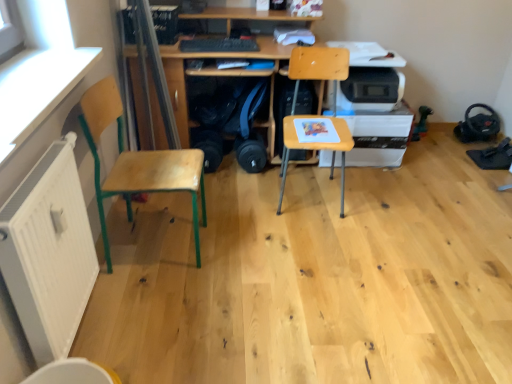
Question: From the image's perspective, is wooden at left, which ranks as the first chair in left-to-right order, above transparent plastic window screen at left?

Choices:
 (A) yes
 (B) no

Answer: (B)

Question: Does wooden at left, which ranks as the first chair in left-to-right order, have a lesser width compared to transparent plastic window screen at left?

Choices:
 (A) no
 (B) yes

Answer: (A)

Question: Can you confirm if wooden at left, positioned as the 2th chair in right-to-left order, is bigger than transparent plastic window screen at left?

Choices:
 (A) no
 (B) yes

Answer: (B)

Question: Considering the relative sizes of wooden at left, positioned as the 2th chair in right-to-left order, and transparent plastic window screen at left in the image provided, is wooden at left, positioned as the 2th chair in right-to-left order, wider than transparent plastic window screen at left?

Choices:
 (A) no
 (B) yes

Answer: (B)

Question: From a real-world perspective, is wooden at left, positioned as the 2th chair in right-to-left order, located beneath transparent plastic window screen at left?

Choices:
 (A) no
 (B) yes

Answer: (B)

Question: Is wooden at left, positioned as the 2th chair in right-to-left order, positioned with its back to transparent plastic window screen at left?

Choices:
 (A) no
 (B) yes

Answer: (A)

Question: Is black matte keyboard at center not within wooden chair at center, the second chair when ordered from left to right?

Choices:
 (A) no
 (B) yes

Answer: (B)

Question: From a real-world perspective, is black matte keyboard at center beneath wooden chair at center, the second chair when ordered from left to right?

Choices:
 (A) yes
 (B) no

Answer: (B)

Question: Considering the relative sizes of black matte keyboard at center and wooden chair at center, the second chair when ordered from left to right, in the image provided, is black matte keyboard at center bigger than wooden chair at center, the second chair when ordered from left to right,?

Choices:
 (A) yes
 (B) no

Answer: (B)

Question: Does black matte keyboard at center have a greater height compared to wooden chair at center, the second chair when ordered from left to right?

Choices:
 (A) yes
 (B) no

Answer: (B)

Question: From the image's perspective, would you say black matte keyboard at center is shown under wooden chair at center, the second chair when ordered from left to right?

Choices:
 (A) no
 (B) yes

Answer: (A)

Question: Considering the relative sizes of black matte keyboard at center and wooden chair at center, arranged as the first chair when viewed from the right, in the image provided, is black matte keyboard at center wider than wooden chair at center, arranged as the first chair when viewed from the right,?

Choices:
 (A) yes
 (B) no

Answer: (B)

Question: Is white plastic printer at center right in contact with white matte radiator at lower left?

Choices:
 (A) no
 (B) yes

Answer: (A)